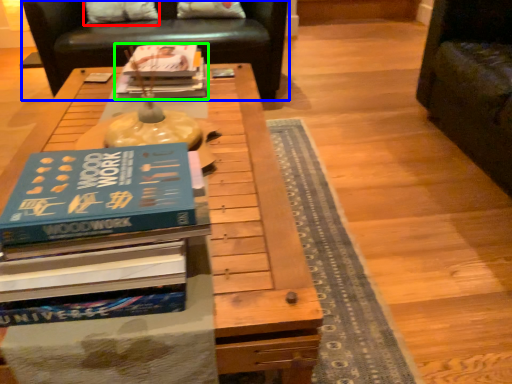
Question: Based on their relative distances, which object is farther from pillow (highlighted by a red box)? Choose from chair (highlighted by a blue box) and book (highlighted by a green box).

Choices:
 (A) chair
 (B) book

Answer: (B)